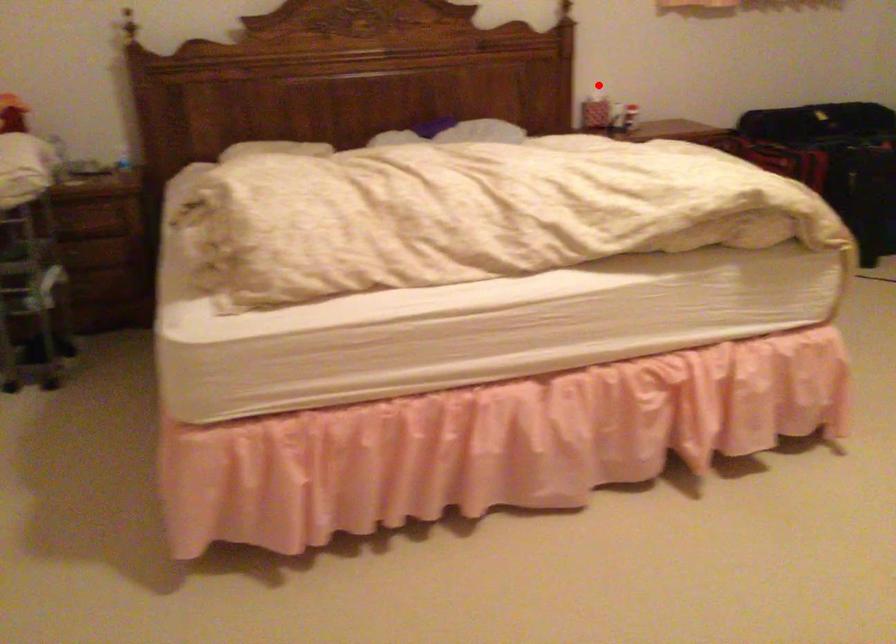
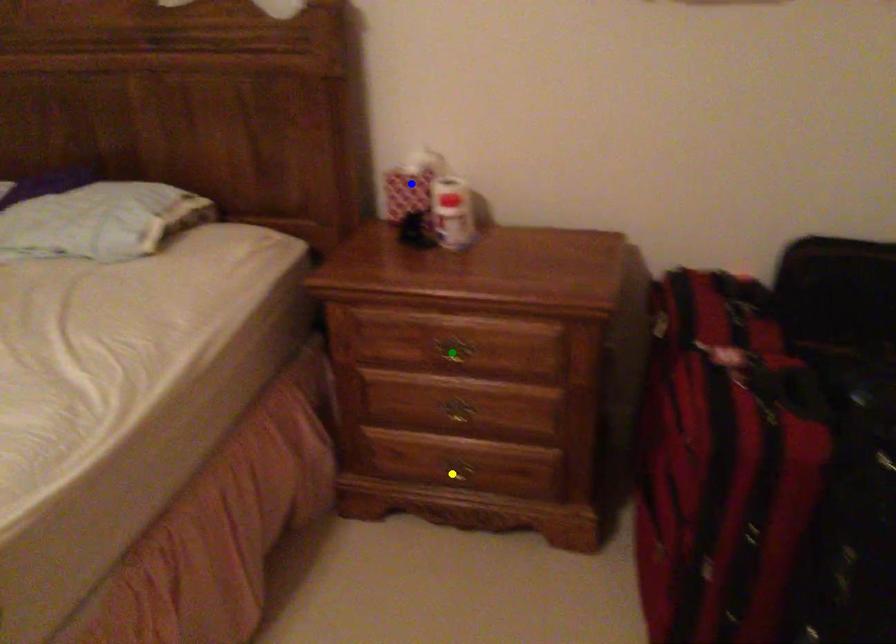
Question: I am providing you with two images of the same scene from different viewpoints. A red point is marked on the first image. You are given multiple points on the second image. Which spot in image 2 lines up with the point in image 1?

Choices:
 (A) blue point
 (B) yellow point
 (C) green point

Answer: (A)